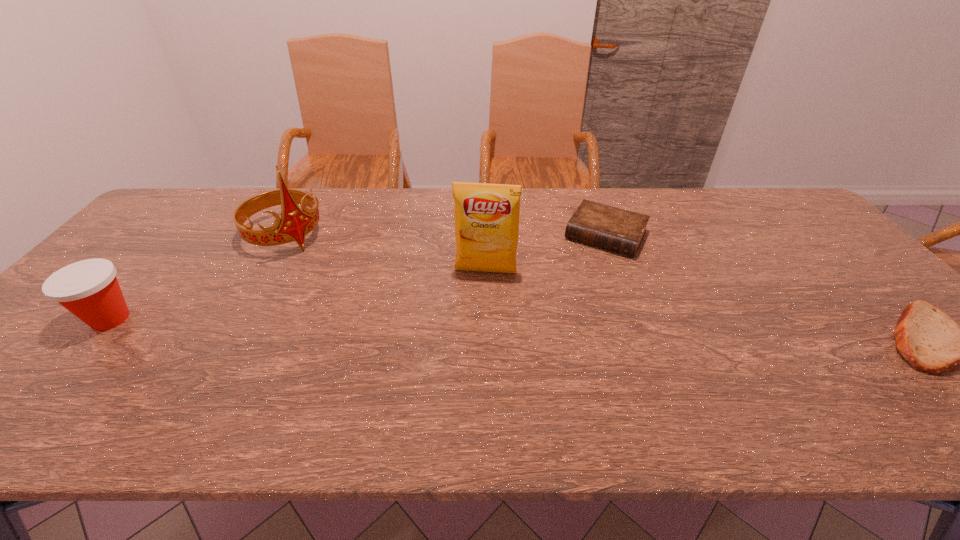
Find the location of a particular element. This screenshot has height=540, width=960. vacant space located on the spine side of the second shortest object is located at coordinates (572, 293).

Identify the location of free location located 0.140m on the front of the crisp (potato chip) with the logo. Image resolution: width=960 pixels, height=540 pixels. (477, 318).

This screenshot has height=540, width=960. Identify the location of vacant point located 0.310m on the front of the crisp (potato chip) with the logo. (469, 374).

Locate an element on the screen. free location located 0.310m on the front of the crisp (potato chip) with the logo is located at coordinates (469, 374).

Identify the location of vacant space located 0.180m on the front-facing side of the fourth object from right to left. (342, 284).

Image resolution: width=960 pixels, height=540 pixels. Find the location of `free region located on the front-facing side of the fourth object from right to left`. free region located on the front-facing side of the fourth object from right to left is located at coordinates (379, 316).

Where is `vacant space located 0.240m on the front-facing side of the fourth object from right to left`? This screenshot has width=960, height=540. vacant space located 0.240m on the front-facing side of the fourth object from right to left is located at coordinates (354, 294).

Image resolution: width=960 pixels, height=540 pixels. Find the location of `diary located in the far edge section of the desktop`. diary located in the far edge section of the desktop is located at coordinates (611, 228).

Identify the location of tiara that is positioned at the far edge. Image resolution: width=960 pixels, height=540 pixels. (294, 224).

Identify the location of object that is positioned at the left edge. (89, 289).